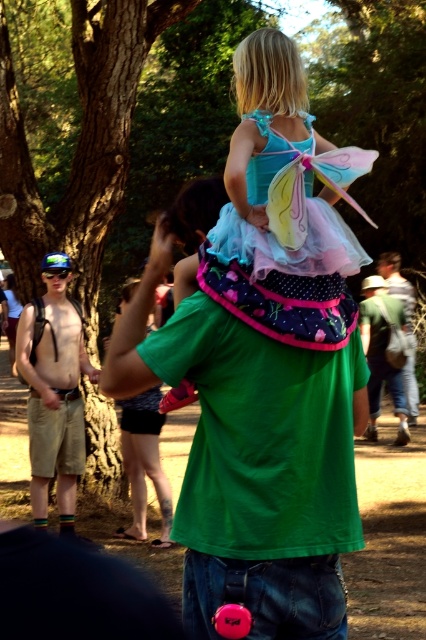
Question: Is pink fabric dress at upper center thinner than green cotton shirt at center?

Choices:
 (A) no
 (B) yes

Answer: (B)

Question: Does shiny metallic shirt at left have a smaller size compared to green cotton shirt at center?

Choices:
 (A) no
 (B) yes

Answer: (B)

Question: Does pastel tulle dress at upper center appear on the left side of green cotton shirt at center?

Choices:
 (A) yes
 (B) no

Answer: (A)

Question: Among these objects, which one is farthest from the camera?

Choices:
 (A) pink fabric at lower center
 (B) shiny metallic shirt at left

Answer: (B)

Question: Which point is farther to the camera?

Choices:
 (A) pink fabric at lower center
 (B) denim jeans at lower right
 (C) pastel tulle dress at upper center
 (D) green cotton shirt at center

Answer: (B)

Question: Which point is closer to the camera?

Choices:
 (A) (389, 253)
 (B) (42, 452)
 (C) (256, 246)

Answer: (C)